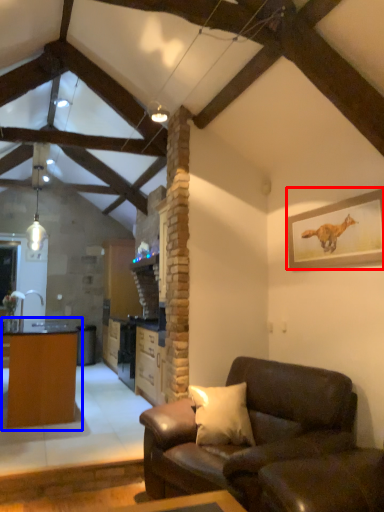
Question: Among these objects, which one is nearest to the camera, picture frame (highlighted by a red box) or table (highlighted by a blue box)?

Choices:
 (A) picture frame
 (B) table

Answer: (A)